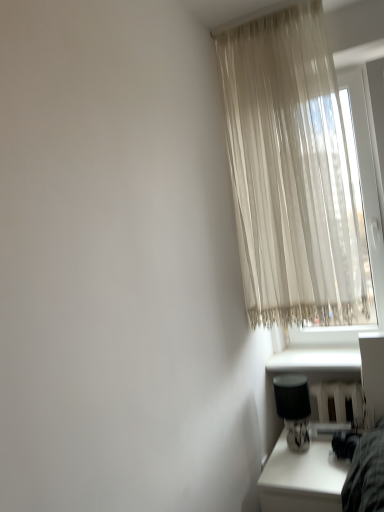
Question: Considering the relative sizes of white glossy table at lower right and white smooth window sill at lower right in the image provided, is white glossy table at lower right shorter than white smooth window sill at lower right?

Choices:
 (A) yes
 (B) no

Answer: (B)

Question: From a real-world perspective, is white glossy table at lower right positioned over white smooth window sill at lower right based on gravity?

Choices:
 (A) yes
 (B) no

Answer: (B)

Question: Is white glossy table at lower right at the right side of white smooth window sill at lower right?

Choices:
 (A) yes
 (B) no

Answer: (B)

Question: Would you consider white glossy table at lower right to be distant from white smooth window sill at lower right?

Choices:
 (A) no
 (B) yes

Answer: (A)

Question: Could you tell me if white glossy table at lower right is facing white smooth window sill at lower right?

Choices:
 (A) yes
 (B) no

Answer: (B)

Question: From the image's perspective, is white glossy table at lower right beneath white smooth window sill at lower right?

Choices:
 (A) yes
 (B) no

Answer: (A)

Question: Does black fabric table lamp at lower right appear on the left side of white glossy table at lower right?

Choices:
 (A) yes
 (B) no

Answer: (A)

Question: From the image's perspective, is black fabric table lamp at lower right located above white glossy table at lower right?

Choices:
 (A) no
 (B) yes

Answer: (B)

Question: From the image's perspective, is black fabric table lamp at lower right beneath white glossy table at lower right?

Choices:
 (A) no
 (B) yes

Answer: (A)

Question: Considering the relative sizes of black fabric table lamp at lower right and white glossy table at lower right in the image provided, is black fabric table lamp at lower right smaller than white glossy table at lower right?

Choices:
 (A) no
 (B) yes

Answer: (B)

Question: Is black fabric table lamp at lower right bigger than white glossy table at lower right?

Choices:
 (A) no
 (B) yes

Answer: (A)

Question: Is black fabric table lamp at lower right positioned with its back to white glossy table at lower right?

Choices:
 (A) no
 (B) yes

Answer: (A)

Question: Does white smooth window sill at lower right appear on the right side of sheer beige curtain at upper right?

Choices:
 (A) yes
 (B) no

Answer: (A)